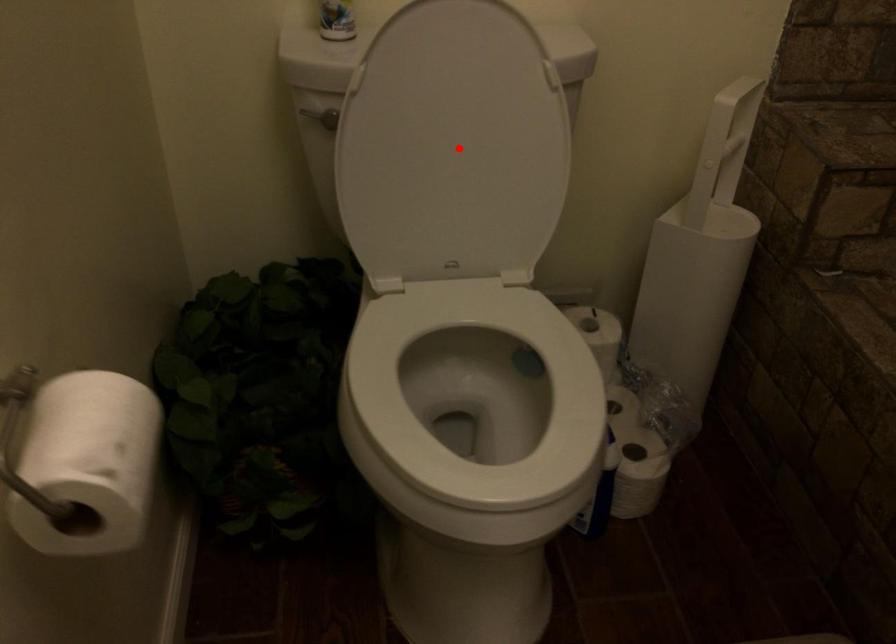
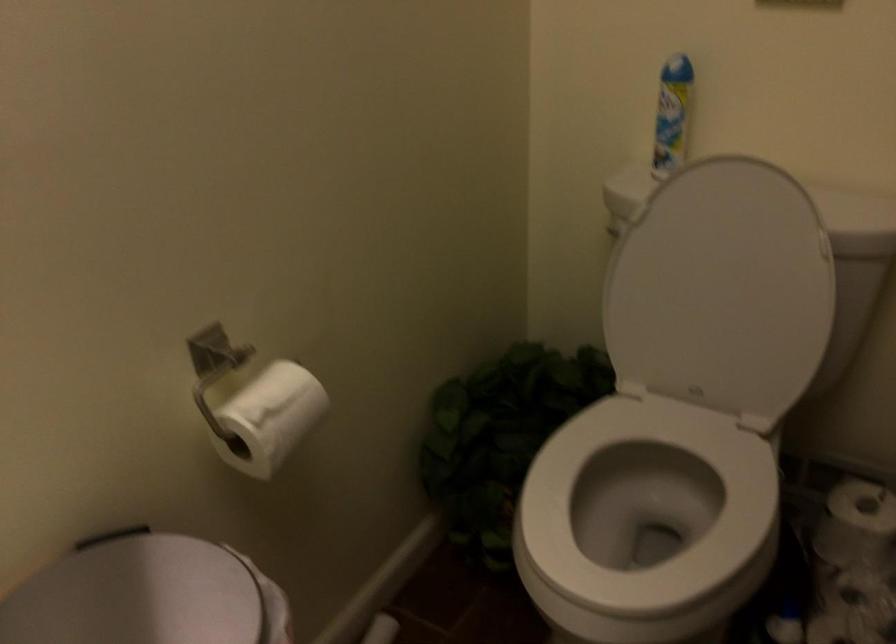
Find the pixel in the second image that matches the highlighted location in the first image.

(721, 289)